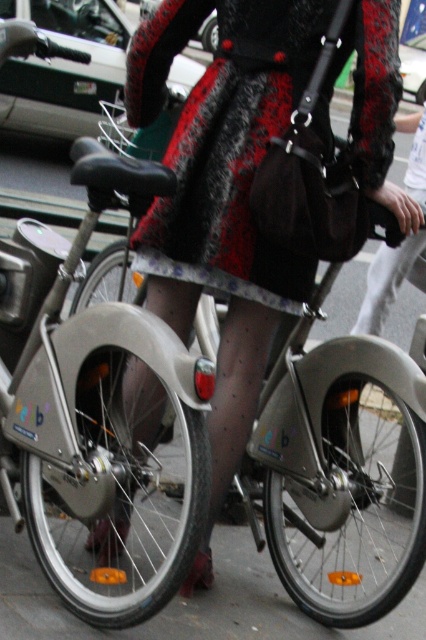
Does point (224, 330) lie in front of point (244, 268)?

No, (224, 330) is further to viewer.

Who is positioned more to the right, velvet-like coat at center or black fuzzy coat at center?

black fuzzy coat at center

Who is more distant from viewer, (253, 22) or (316, 36)?

The point (253, 22) is behind.

Identify the location of velvet-like coat at center. This screenshot has height=640, width=426. (259, 184).

Is black fuzzy coat at center above white sheer stocking at lower center?

No.

Where is `black fuzzy coat at center`? black fuzzy coat at center is located at coordinates (224, 140).

Does velvet-like coat at center have a smaller size compared to white sheer stocking at lower center?

Indeed, velvet-like coat at center has a smaller size compared to white sheer stocking at lower center.

Does velvet-like coat at center appear on the left side of white sheer stocking at lower center?

Yes, velvet-like coat at center is to the left of white sheer stocking at lower center.

Who is more distant from viewer, (172, 224) or (394, 280)?

Point (394, 280)

Find the location of a particular element. The width and height of the screenshot is (426, 640). velvet-like coat at center is located at coordinates (259, 184).